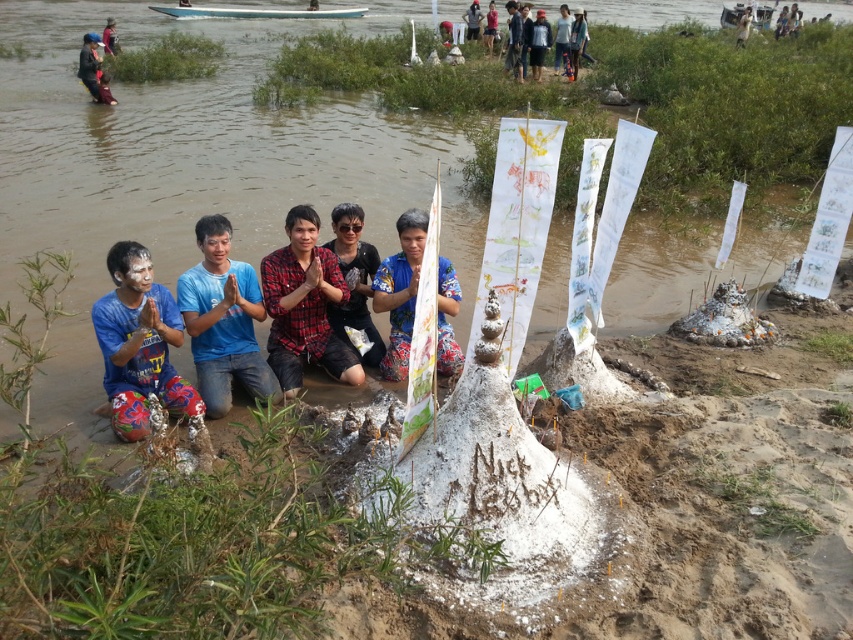
From the picture: Which of these two, red plaid shirt at center or dark blue fabric at upper left, stands shorter?

red plaid shirt at center

Between point (291, 384) and point (90, 84), which one is positioned in front?

Point (291, 384) is in front.

The image size is (853, 640). Find the location of `red plaid shirt at center`. red plaid shirt at center is located at coordinates (305, 305).

In the scene shown: Can you confirm if red plaid shirt at center is positioned above printed fabric shirt at center?

Actually, red plaid shirt at center is below printed fabric shirt at center.

Can you confirm if red plaid shirt at center is shorter than printed fabric shirt at center?

Incorrect, red plaid shirt at center's height does not fall short of printed fabric shirt at center's.

Does point (292, 282) come in front of point (445, 289)?

Yes, point (292, 282) is closer to viewer.

I want to click on red plaid shirt at center, so click(x=305, y=305).

What do you see at coordinates (223, 321) in the screenshot?
I see `blue cotton shirt at center` at bounding box center [223, 321].

Between blue cotton shirt at center and printed fabric shirt at center, which one has more height?

Standing taller between the two is blue cotton shirt at center.

Image resolution: width=853 pixels, height=640 pixels. I want to click on blue cotton shirt at center, so click(223, 321).